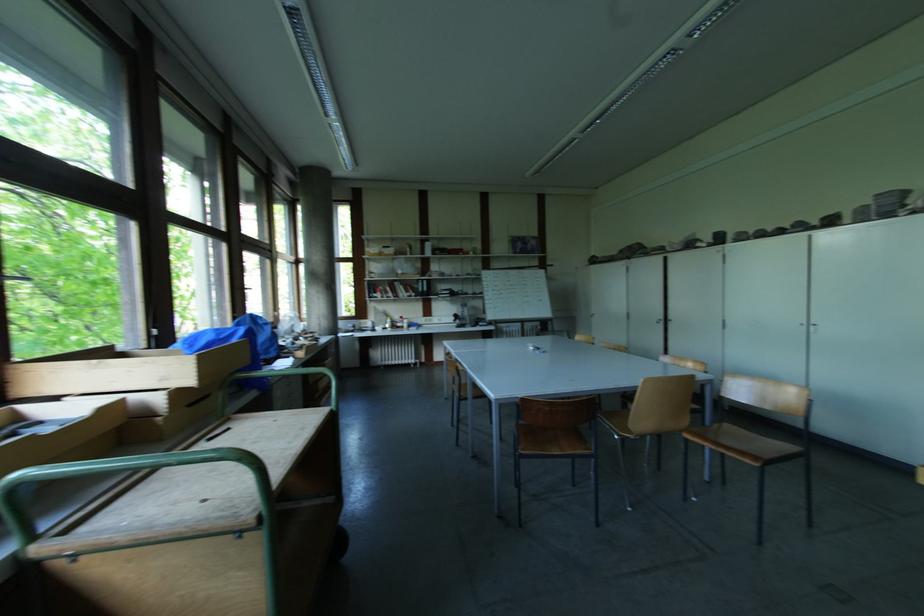
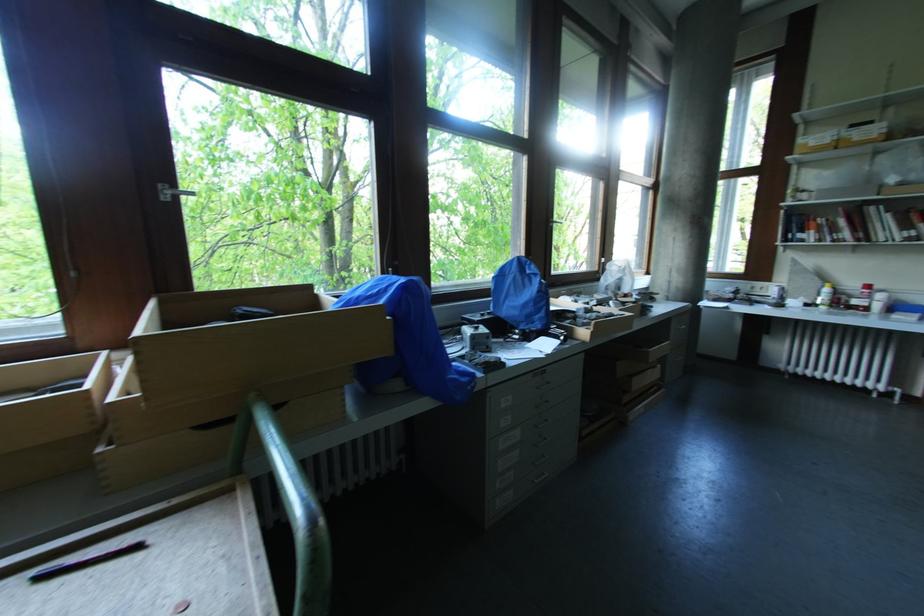
In the second image, find the point that corresponds to pixel 405 318 in the first image.

(871, 288)